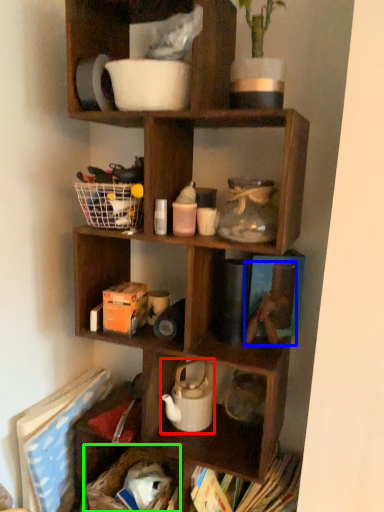
Question: Which object is the closest to the tea pot (highlighted by a red box)? Choose among these: toy (highlighted by a blue box) or basket (highlighted by a green box).

Choices:
 (A) toy
 (B) basket

Answer: (B)